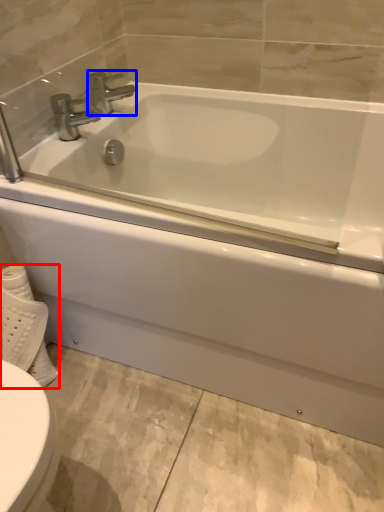
Question: Which object appears closest to the camera in this image, toilet paper (highlighted by a red box) or tap (highlighted by a blue box)?

Choices:
 (A) toilet paper
 (B) tap

Answer: (A)